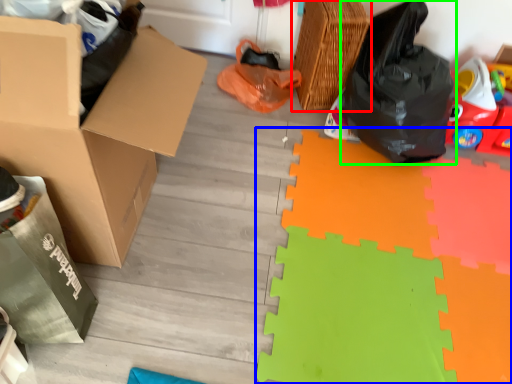
Question: Based on their relative distances, which object is farther from basket (highlighted by a red box)? Choose from doormat (highlighted by a blue box) and plastic bag (highlighted by a green box).

Choices:
 (A) doormat
 (B) plastic bag

Answer: (A)